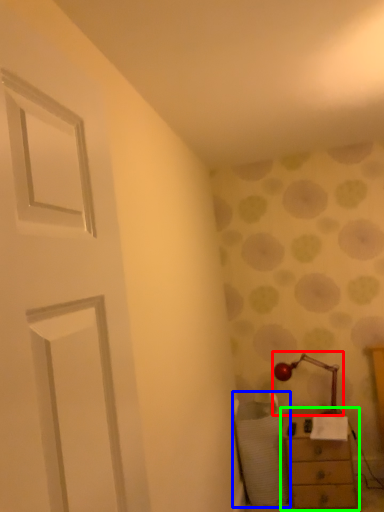
Question: Which is farther away from table lamp (highlighted by a red box)? swivel chair (highlighted by a blue box) or chest of drawers (highlighted by a green box)?

Choices:
 (A) swivel chair
 (B) chest of drawers

Answer: (A)